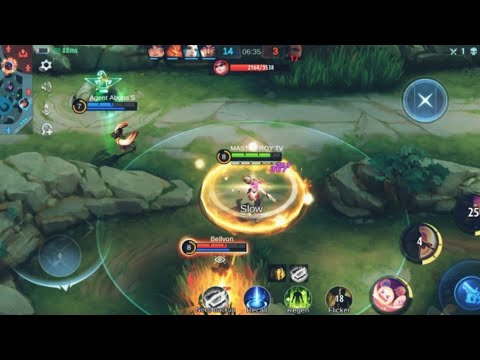
Locate an element on the screen. map is located at coordinates (6, 82).